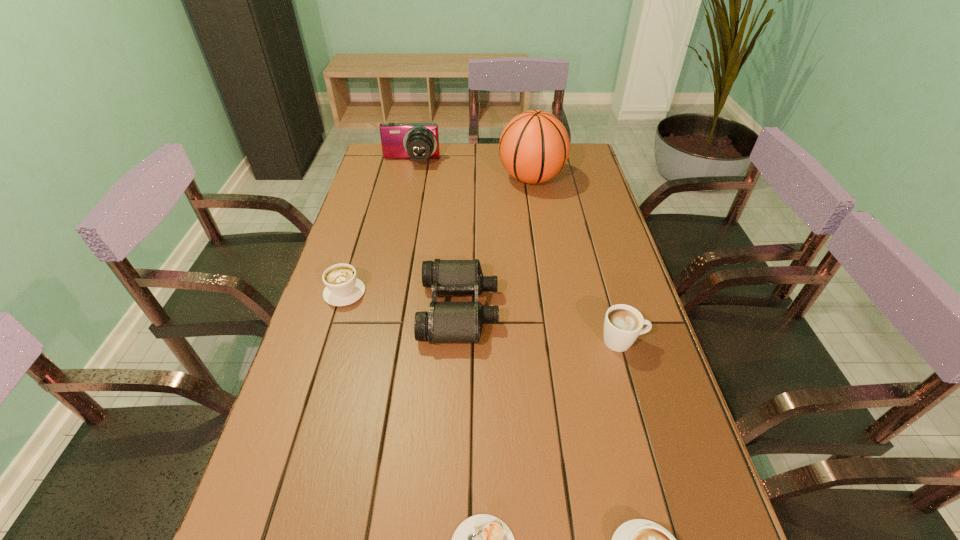
This screenshot has width=960, height=540. In order to click on the tallest object in this screenshot , I will do `click(534, 146)`.

Identify the location of the sixth shortest object. Image resolution: width=960 pixels, height=540 pixels. (418, 141).

What are the coordinates of `binoculars` in the screenshot? It's located at (446, 322).

In order to click on the second farthest cappuccino in this screenshot , I will do `click(623, 323)`.

The width and height of the screenshot is (960, 540). Find the location of `the farthest cappuccino`. the farthest cappuccino is located at coordinates (342, 288).

Image resolution: width=960 pixels, height=540 pixels. I want to click on the fifth tallest object, so click(342, 288).

I want to click on vacant space situated 0.110m on the front of the basketball, so click(x=538, y=215).

This screenshot has height=540, width=960. I want to click on free location located 0.380m on the front-facing side of the sixth shortest object, so click(396, 233).

Locate an element on the screen. Image resolution: width=960 pixels, height=540 pixels. vacant space located through the eyepieces of the binoculars is located at coordinates (623, 309).

Image resolution: width=960 pixels, height=540 pixels. In order to click on free space located 0.080m to the right of the leftmost cappuccino's handle in this screenshot , I will do `click(355, 258)`.